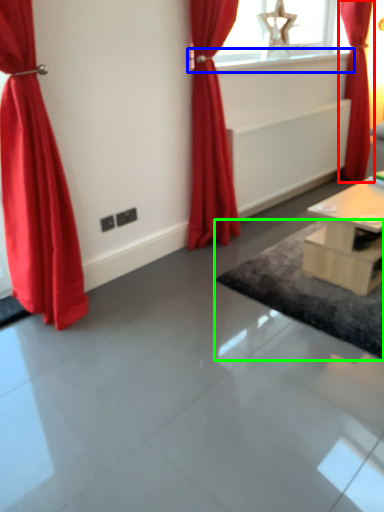
Question: Considering the real-world distances, which object is farthest from curtain (highlighted by a red box)? window sill (highlighted by a blue box) or mat (highlighted by a green box)?

Choices:
 (A) window sill
 (B) mat

Answer: (B)